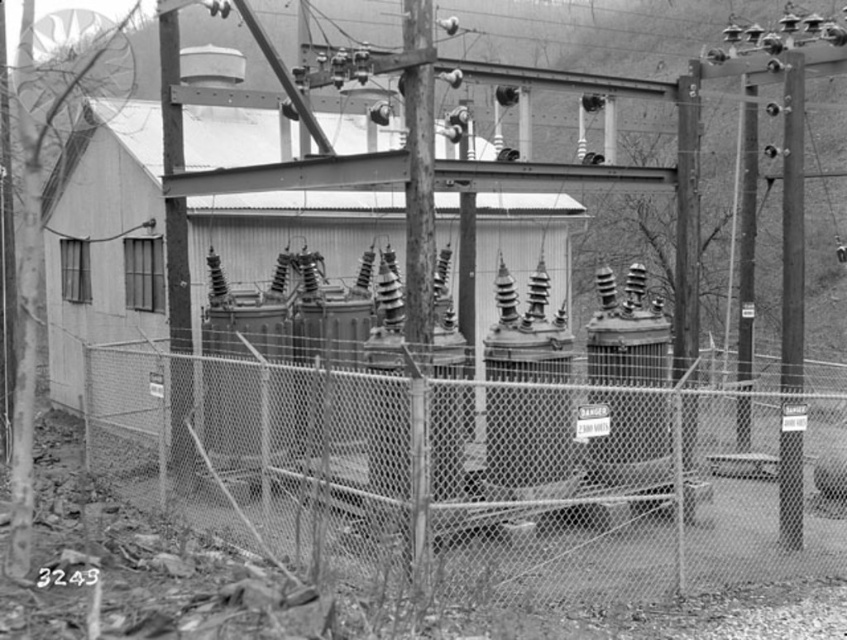
In the scene shown: You are a technician in the substation and need to access two points for maintenance. The first point is at coordinate point (793, 134) and the second is at point (162, 67). Which point should you prioritize if you want to work on the closer one first?

You should prioritize point (793, 134) first because it is closer to the viewer than point (162, 67).

You are a technician needing to access the metallic gray pole at right for maintenance. You are currently standing outside the chain link fence at center. Can you reach the pole without crossing the fence?

The chain link fence at center is positioned on the left side of metallic gray pole at right, meaning the pole is to the right of the fence. Since you are outside the fence, you would need to go around or through the fence to access the pole on the other side.